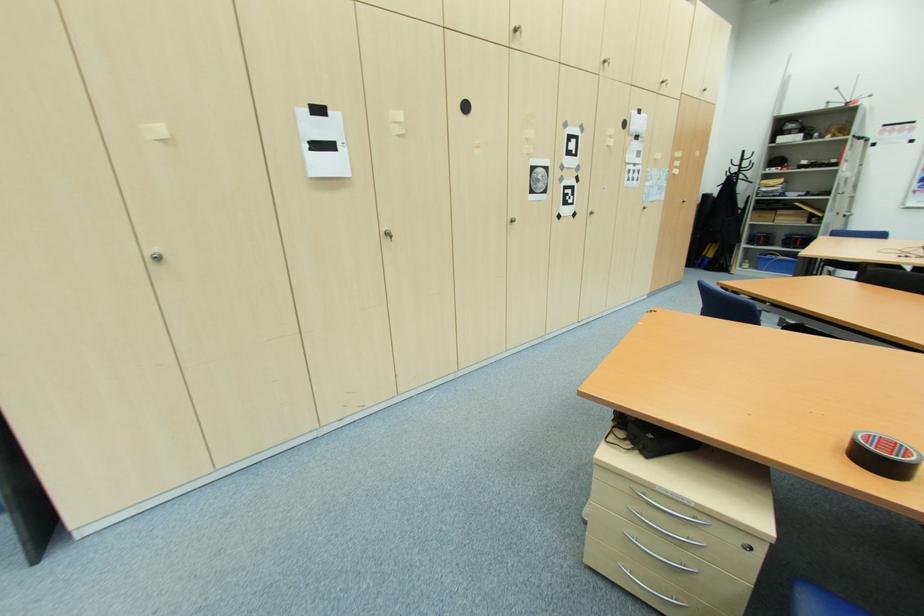
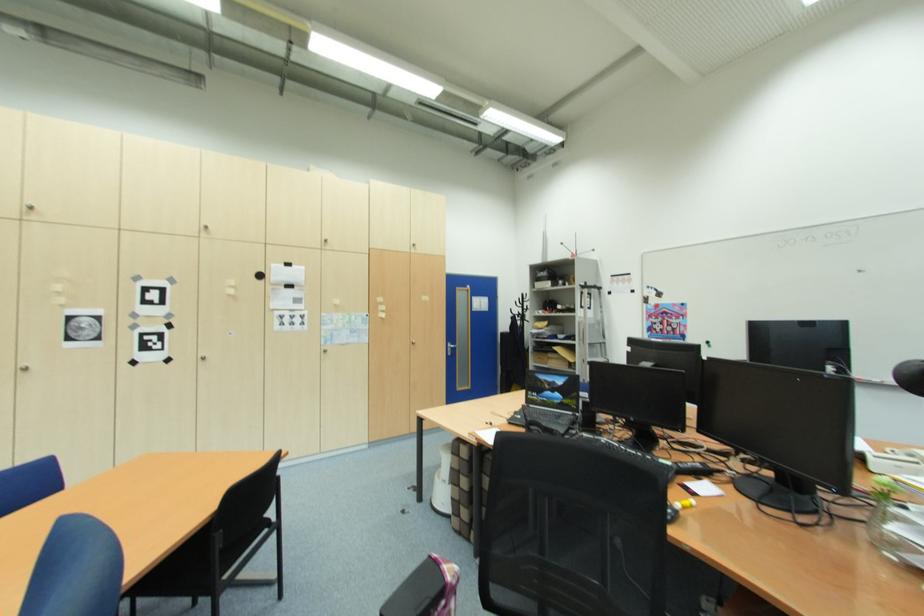
In the second image, find the point that corresponds to point 687,203 in the first image.

(418, 345)